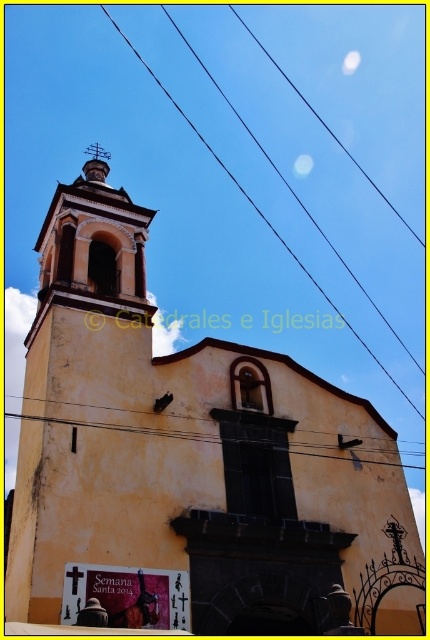
Who is more forward, (178,28) or (146,433)?

Point (146,433) is in front.

Based on the photo, who is more distant from viewer, (365,344) or (361,460)?

The point (365,344) is behind.

Does point (272, 227) come behind point (187, 436)?

Yes, point (272, 227) is behind point (187, 436).

Image resolution: width=430 pixels, height=640 pixels. I want to click on black wire at upper center, so click(255, 205).

Is black wire at upper center shorter than smooth gold spire at upper center?

In fact, black wire at upper center may be taller than smooth gold spire at upper center.

Does black wire at upper center appear on the right side of smooth gold spire at upper center?

Correct, you'll find black wire at upper center to the right of smooth gold spire at upper center.

Identify the location of black wire at upper center. Image resolution: width=430 pixels, height=640 pixels. (255, 205).

I want to click on black wire at upper center, so pos(255,205).

Is yellowish matte power line at center smaller than smooth gold spire at upper center?

Incorrect, yellowish matte power line at center is not smaller in size than smooth gold spire at upper center.

Does yellowish matte power line at center come behind smooth gold spire at upper center?

No, yellowish matte power line at center is in front of smooth gold spire at upper center.

Does point (20, 413) come in front of point (92, 161)?

No, (20, 413) is further to viewer.

Find the location of a particular element. The height and width of the screenshot is (640, 430). yellowish matte power line at center is located at coordinates (120, 428).